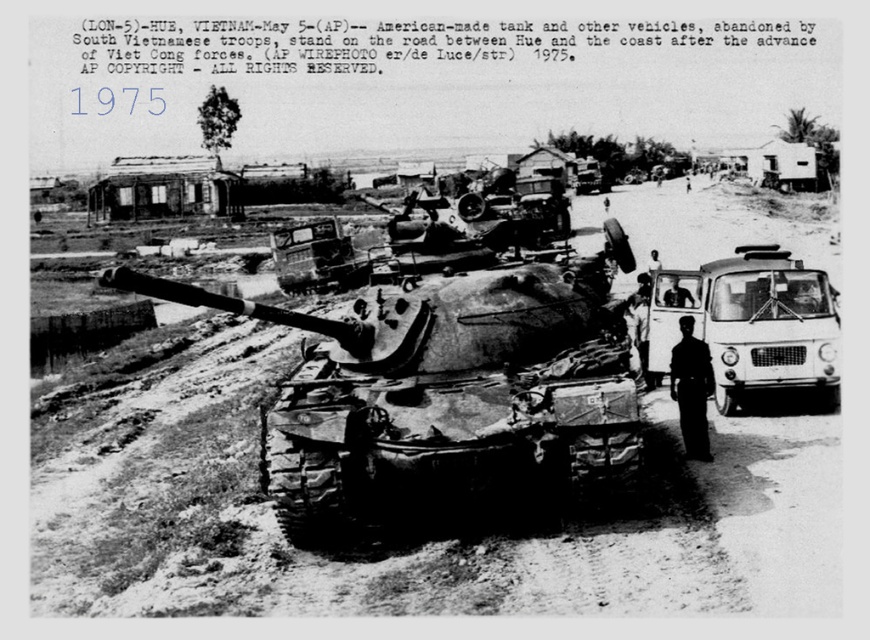
You are a photographer analyzing this historical image. You need to determine if the weathered steel tank at center can fit through a narrow alleyway that the white matte van at right just barely passed through. Based on their widths, what is your conclusion?

The weathered steel tank at center is narrower than the white matte van at right, so it can fit through the alleyway the van just barely passed through.

You are a photographer standing at the camera position in the scene. You want to capture a closeup shot of the white matte van at right. Given that your camera can focus on objects within 10 meters, will you be able to take the closeup without moving closer?

The distance between the white matte van at right and the camera is 10.38 meters, which is slightly beyond the camera focus range of 10 meters. Therefore, you cannot take the closeup without moving closer.